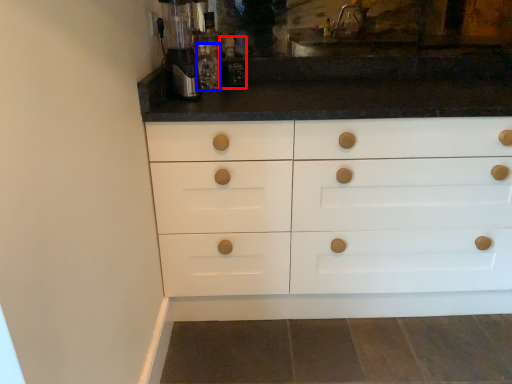
Question: Which of the following is the farthest to the observer, bottle (highlighted by a red box) or bottle (highlighted by a blue box)?

Choices:
 (A) bottle
 (B) bottle

Answer: (A)